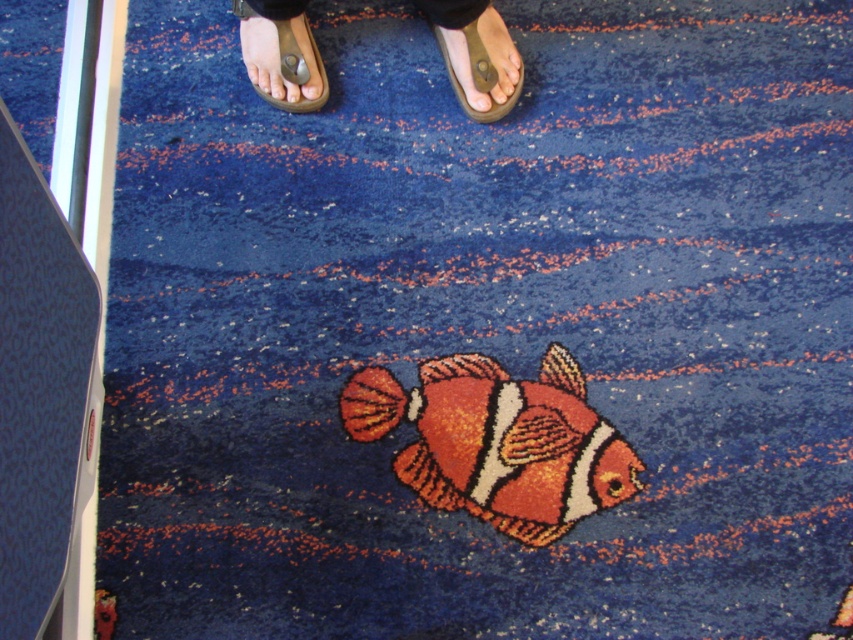
Question: Is orange felt clown fish at center smaller than matte brown flip-flop at upper center?

Choices:
 (A) no
 (B) yes

Answer: (A)

Question: Which of these objects is positioned farthest from the brown leather sandal at upper center?

Choices:
 (A) orange felt clown fish at center
 (B) matte brown flip-flop at upper center

Answer: (A)

Question: Does orange felt clown fish at center have a greater width compared to brown leather sandal at upper center?

Choices:
 (A) yes
 (B) no

Answer: (A)

Question: Considering the real-world distances, which object is farthest from the matte brown flip-flop at upper center?

Choices:
 (A) brown leather sandals at upper center
 (B) orange felt clown fish at center

Answer: (B)

Question: Which object is the farthest from the orange felt clown fish at center?

Choices:
 (A) brown leather sandal at upper center
 (B) matte brown flip-flop at upper center
 (C) brown leather sandals at upper center

Answer: (B)

Question: Is brown leather sandal at upper center behind matte brown flip-flop at upper center?

Choices:
 (A) no
 (B) yes

Answer: (B)